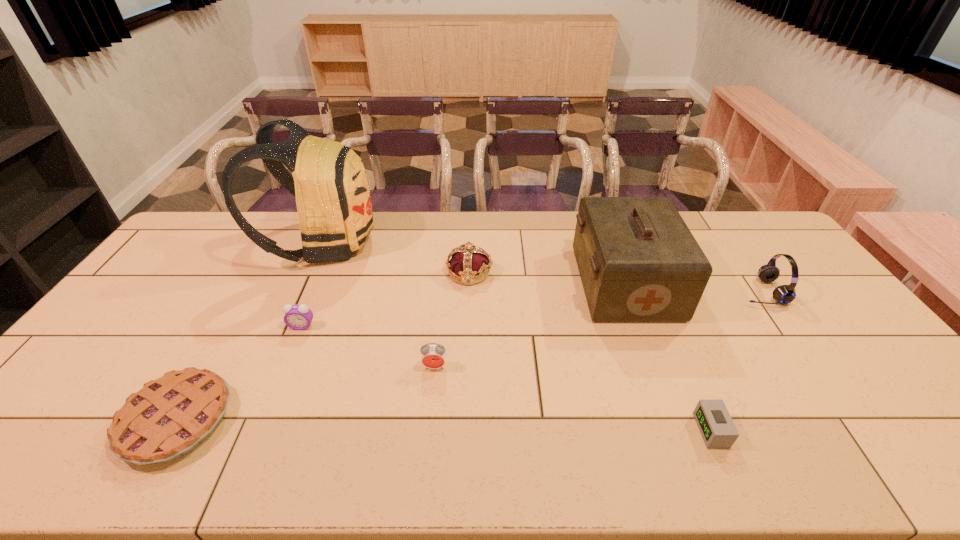
Where is `vacant region located 0.250m on the front-facing side of the rightmost alarm clock`? The image size is (960, 540). vacant region located 0.250m on the front-facing side of the rightmost alarm clock is located at coordinates (592, 430).

This screenshot has width=960, height=540. In order to click on free space located on the front-facing side of the rightmost alarm clock in this screenshot , I will do `click(660, 430)`.

Find the location of a particular element. This screenshot has width=960, height=540. vacant space located on the left of the pie is located at coordinates (24, 421).

Image resolution: width=960 pixels, height=540 pixels. I want to click on object that is at the far edge, so click(329, 181).

The height and width of the screenshot is (540, 960). I want to click on alarm clock present at the near edge, so click(x=717, y=428).

I want to click on pie that is at the near edge, so click(169, 417).

The height and width of the screenshot is (540, 960). In order to click on object that is at the right edge in this screenshot , I will do `click(784, 294)`.

You are a GUI agent. You are given a task and a screenshot of the screen. Output one action in this format:
    pyautogui.click(x=<x>, y=<y>)
    Task: Click on the free space at the far edge of the desktop
    The image size is (960, 540).
    Given the screenshot: What is the action you would take?
    pyautogui.click(x=444, y=240)

Where is `free space at the near edge of the desktop`? The height and width of the screenshot is (540, 960). free space at the near edge of the desktop is located at coordinates (212, 453).

The height and width of the screenshot is (540, 960). In the image, there is a desktop. What are the coordinates of `vacant space at the left edge` in the screenshot? It's located at (113, 351).